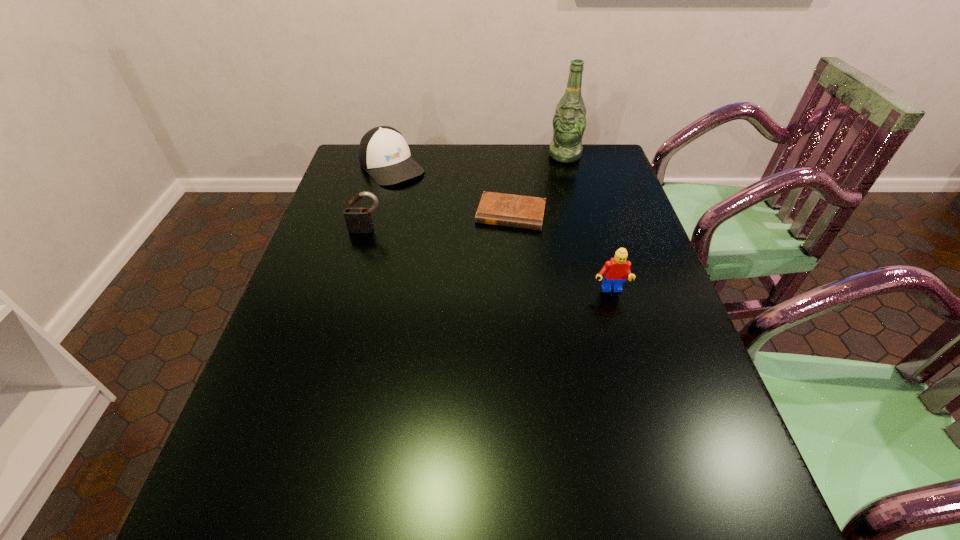
Find the location of a particular element. The width and height of the screenshot is (960, 540). free space between the padlock and the cap is located at coordinates (379, 198).

Choose which object is the fourth nearest neighbor to the Lego. Please provide its 2D coordinates. Your answer should be formatted as a tuple, i.e. [(x, y)], where the tuple contains the x and y coordinates of a point satisfying the conditions above.

[(384, 154)]

Locate which object is the fourth closest to the padlock. Please provide its 2D coordinates. Your answer should be formatted as a tuple, i.e. [(x, y)], where the tuple contains the x and y coordinates of a point satisfying the conditions above.

[(569, 122)]

At what (x,y) coordinates should I click in order to perform the action: click on free space that satisfies the following two spatial constraints: 1. on the back side of the cap; 2. on the right side of the tallest object. Please return your answer as a coordinate pair (x, y). This screenshot has width=960, height=540. Looking at the image, I should click on (395, 156).